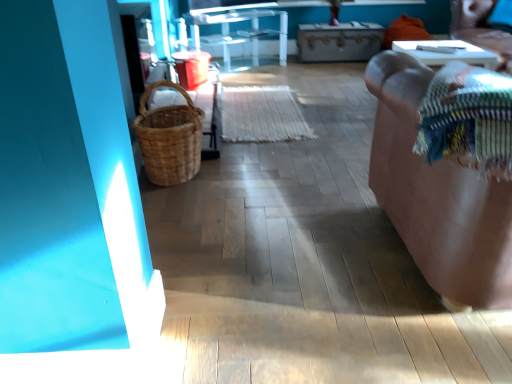
Question: Is multicolored woven blanket at right in front of or behind wooden drawer at center in the image?

Choices:
 (A) front
 (B) behind

Answer: (A)

Question: Based on their positions, is multicolored woven blanket at right located to the left or right of wooden drawer at center?

Choices:
 (A) left
 (B) right

Answer: (A)

Question: Which object is the farthest from the wooden drawer at center?

Choices:
 (A) brown woven basket at upper right
 (B) transparent glass table at center, which is the 2th furniture in right-to-left order
 (C) brown leather couch at right, the 1th furniture in the bottom-to-top sequence
 (D) multicolored woven blanket at right

Answer: (D)

Question: Estimate the real-world distances between objects in this image. Which object is farther from the transparent glass table at center, which is the first furniture from back to front?

Choices:
 (A) brown woven basket at upper right
 (B) multicolored woven blanket at right
 (C) wooden drawer at center
 (D) brown leather couch at right, the 2th furniture when ordered from back to front

Answer: (B)